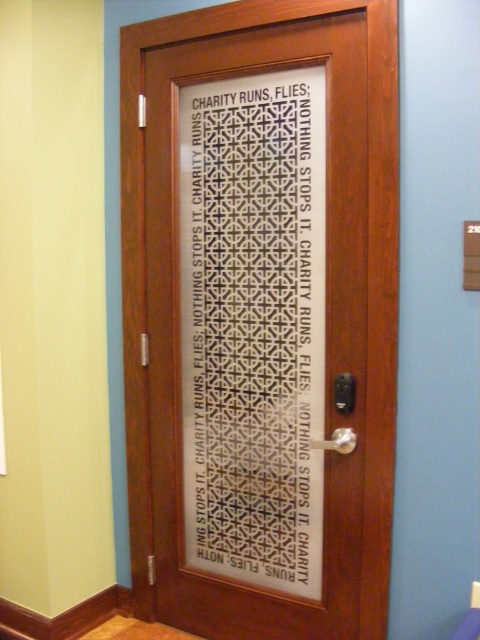
You are standing in front of the wooden door with the decorative glass panel. You notice two points marked on the glass. The first point is at coordinates point (377, 586) and the second is at point (197, 93). Which of these two points appears closer to you?

Point (377, 586) is closer to the viewer than point (197, 93).

You are standing in front of the wooden door with a decorative glass panel. You notice a specific point marked at coordinates point (x=261, y=316). What does this point represent on the door?

The point (x=261, y=316) represents the transparent glass door at center.

You are standing in front of the wooden door with a decorative glass panel. You notice the transparent glass door at center and the white lattice door at center. Which one is positioned lower?

The transparent glass door at center is located below the white lattice door at center, so it is positioned lower.